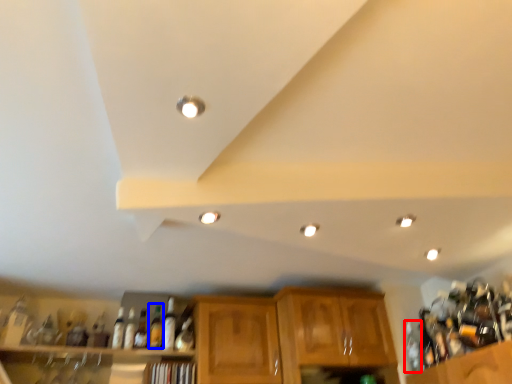
Question: Among these objects, which one is nearest to the camera, bottle (highlighted by a red box) or beverage (highlighted by a blue box)?

Choices:
 (A) bottle
 (B) beverage

Answer: (A)